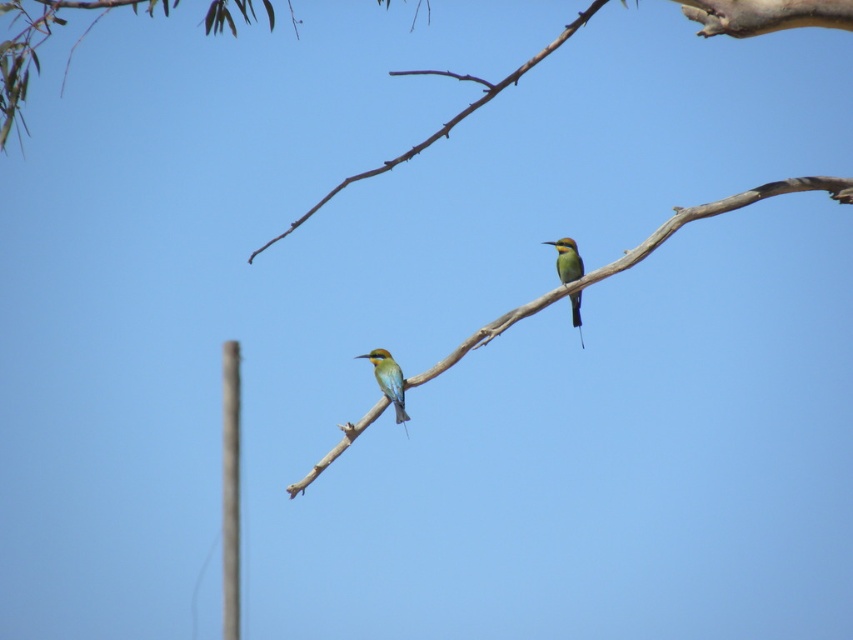
From the picture: You are a birdwatcher observing the two birds on the branch. The point marked at coordinates (637, 257) is where you want to place a small marker. Based on the scene description, can you confirm if this point is on the smooth part of the branch?

The point at coordinates (637, 257) is on the smooth wood branch at center, so yes, the marker can be placed there as it is on the smooth part of the branch.

You are a bird enthusiast observing the scene. You notice the smooth wood branch at center and the green iridescent parrot at center. How far apart are these two objects?

The smooth wood branch at center and the green iridescent parrot at center are 49.41 centimeters apart.

You are a birdwatcher trying to document the height of the smooth wood branch at center and the green iridescent parrot at center. Based on the scene, which object is taller?

The smooth wood branch at center is much taller than the green iridescent parrot at center.